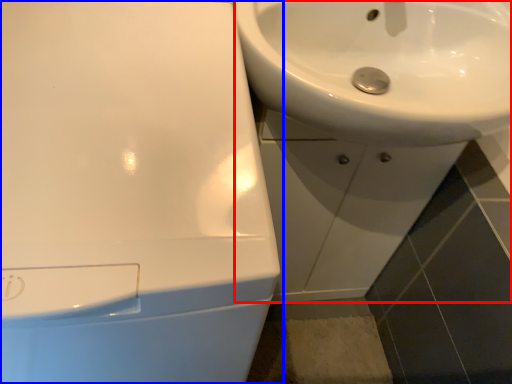
Question: Among these objects, which one is farthest to the camera, sink (highlighted by a red box) or sink (highlighted by a blue box)?

Choices:
 (A) sink
 (B) sink

Answer: (A)